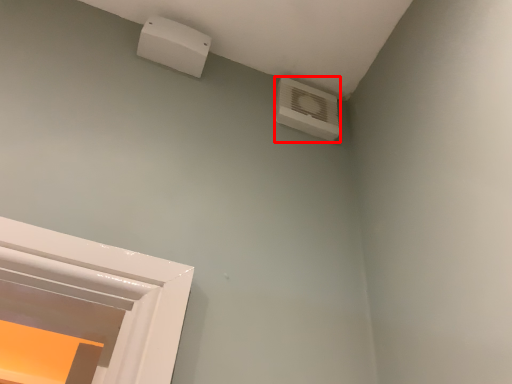
Question: From the image's perspective, what is the correct spatial relationship of air conditioning (annotated by the red box) in relation to electric outlet?

Choices:
 (A) above
 (B) below

Answer: (B)